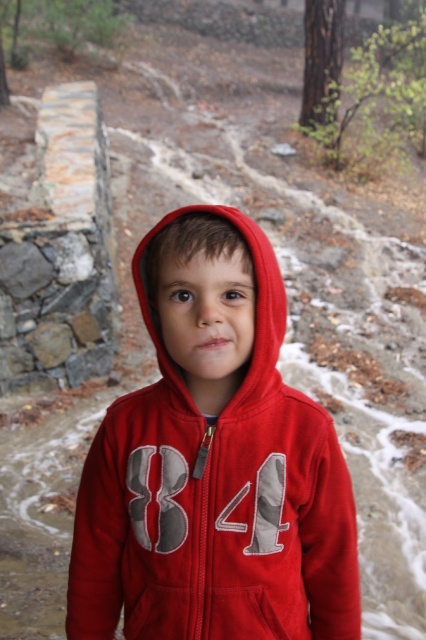
You are a fashion designer trying to create a new line of layered clothing. You want to ensure that the matte fleece hoodie at center and the red fleece hoodie at center can be worn together without overlapping. What is the minimum distance required between them to achieve this?

The matte fleece hoodie at center is 20.36 centimeters away from the red fleece hoodie at center, so to ensure they don not overlap when worn together, the minimum distance should be at least 20.36 centimeters.

From the picture: You are a photographer trying to capture both the matte fleece hoodie at center and the red fleece hoodie at center in a single shot. Which one should you focus on first to ensure both are in frame?

The matte fleece hoodie at center is located below the red fleece hoodie at center, so you should focus on the red fleece hoodie at center first to ensure both are in frame.